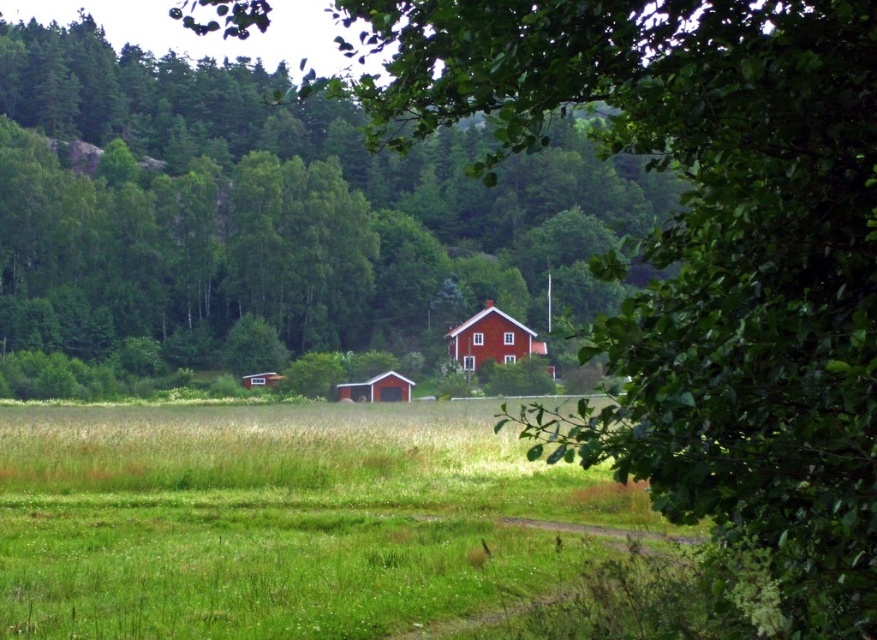
Question: Estimate the real-world distances between objects in this image. Which object is closer to the green leafy tree at center?

Choices:
 (A) wooden barn at center
 (B) matte red barn at center

Answer: (A)

Question: Is the position of green leafy tree at center less distant than that of matte red barn at center?

Choices:
 (A) no
 (B) yes

Answer: (A)

Question: Which of the following is the closest to the observer?

Choices:
 (A) (396, 396)
 (B) (251, 378)
 (C) (322, 342)

Answer: (A)

Question: Which object is farther from the camera taking this photo?

Choices:
 (A) wooden barn at center
 (B) green leafy tree at center
 (C) matte red barn at center

Answer: (B)

Question: Can you confirm if green leafy tree at center is thinner than wooden barn at center?

Choices:
 (A) no
 (B) yes

Answer: (A)

Question: Does green leafy tree at center have a smaller size compared to matte red barn at center?

Choices:
 (A) yes
 (B) no

Answer: (B)